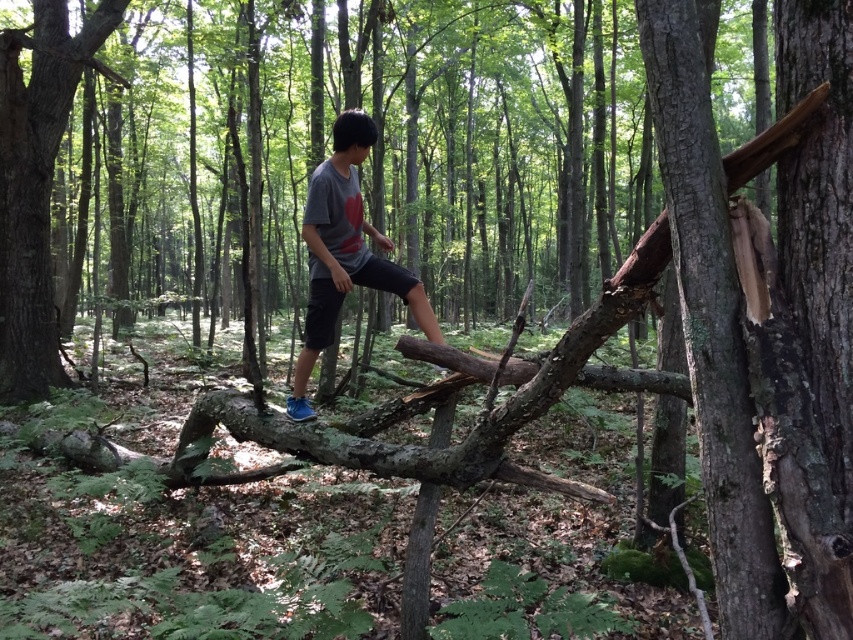
You are navigating through the forest and need to cross the smooth brown tree trunk at center right. Based on its position, can you estimate where exactly it is located in the image?

The smooth brown tree trunk at center right is located at point coordinates of 0.509 on the x axis and 0.835 on the y axis.

You are navigating through a dense forest and need to cross a fallen tree trunk. You see a smooth brown tree trunk at center right located at point [711,324]. Can you use this point to determine the exact location of the smooth brown tree trunk at center right relative to your current position?

The smooth brown tree trunk at center right is located at point [711,324], which means it is positioned at the center right of the image. Since the coordinate system typically places the origin at the bottom left corner, the x and y values of 0.509 and 0.835 respectively indicate its exact position relative to your current viewpoint in the scene.